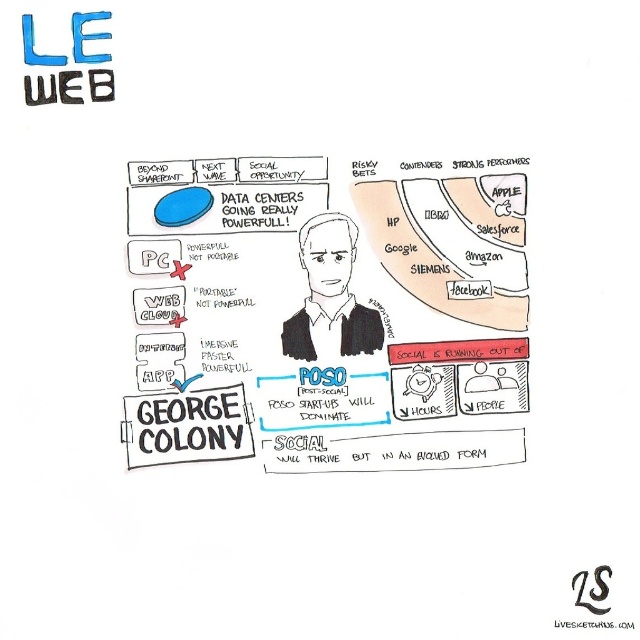
In the scene shown: You are an attendee at a conference where this slide is being presented. You notice the matte black text at center and the black matte portrait at center. Which element do you think is larger in size?

The matte black text at center is bigger than the black matte portrait at center, so the matte black text at center is larger in size.